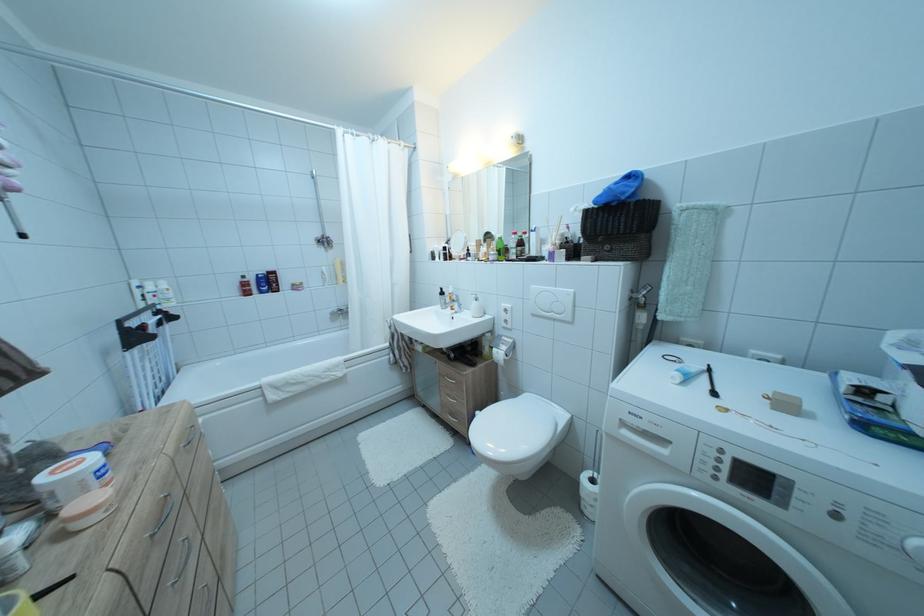
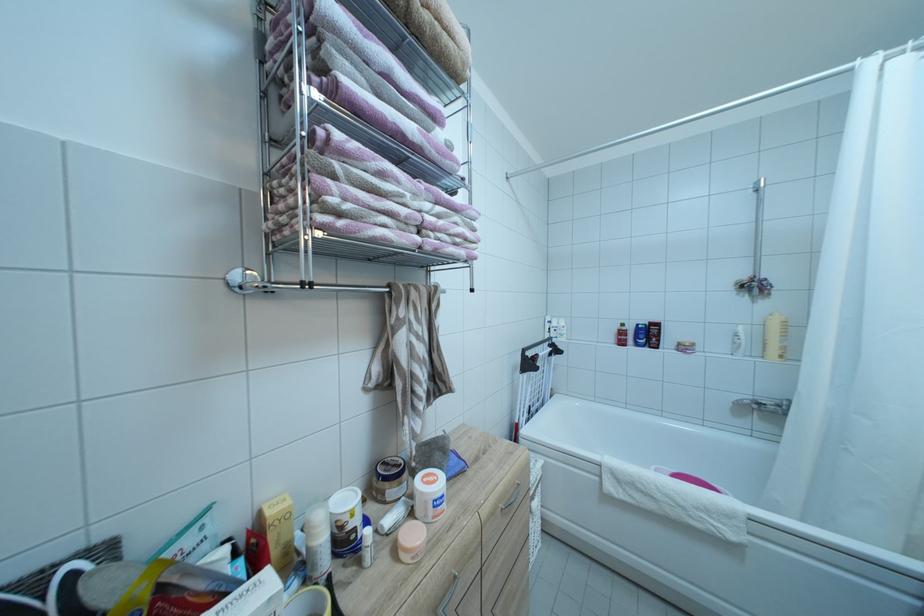
The point at (266,292) is marked in the first image. Where is the corresponding point in the second image?

(642, 342)